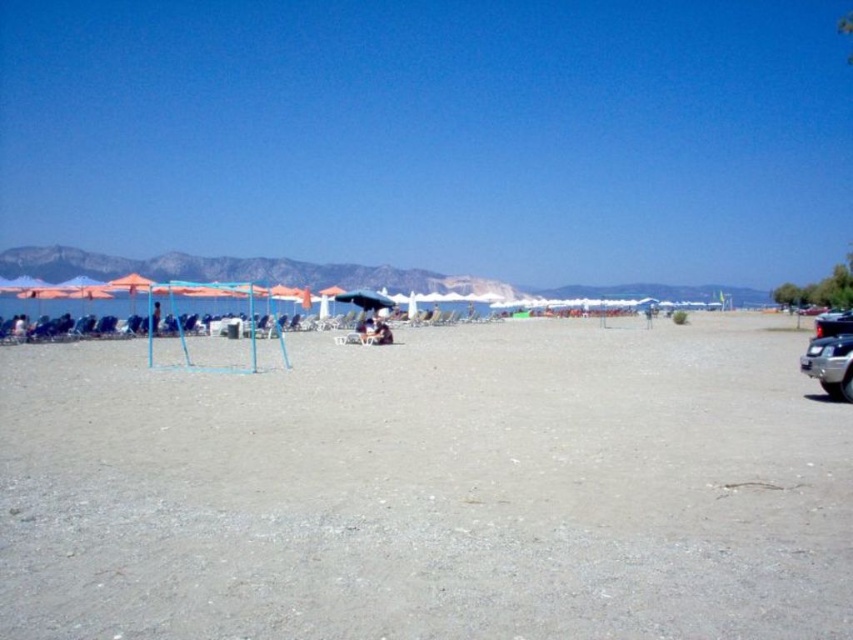
Consider the image. Who is positioned more to the right, gray sand at center or shiny black car at right?

From the viewer's perspective, shiny black car at right appears more on the right side.

Can you confirm if gray sand at center is shorter than shiny black car at right?

Yes.

Is point (524, 428) in front of point (816, 333)?

That is True.

Identify the location of gray sand at center. The width and height of the screenshot is (853, 640). (428, 490).

Between metallic silver car at right and shiny black car at right, which one appears on the right side from the viewer's perspective?

From the viewer's perspective, shiny black car at right appears more on the right side.

Who is taller, metallic silver car at right or shiny black car at right?

Standing taller between the two is shiny black car at right.

Is point (827, 355) closer to camera compared to point (822, 320)?

Yes, it is in front of point (822, 320).

This screenshot has height=640, width=853. In order to click on metallic silver car at right in this screenshot , I will do (830, 364).

The width and height of the screenshot is (853, 640). Identify the location of gray sand at center. (428, 490).

Who is positioned more to the left, gray sand at center or blue denim shorts at center?

From the viewer's perspective, blue denim shorts at center appears more on the left side.

Which is behind, point (459, 433) or point (386, 342)?

Positioned behind is point (386, 342).

Identify the location of gray sand at center. (428, 490).